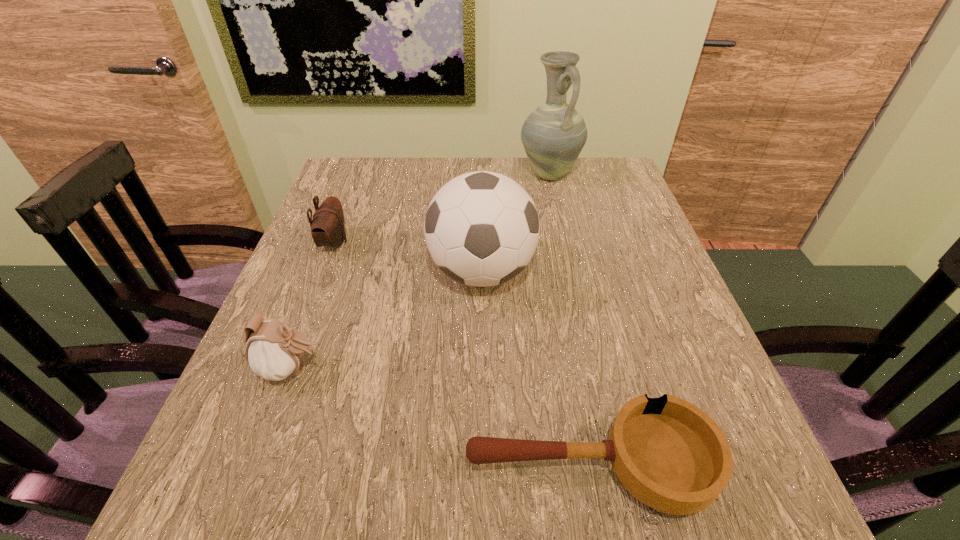
You are a GUI agent. You are given a task and a screenshot of the screen. Output one action in this format:
    pyautogui.click(x=<x>, y=<y>)
    Task: Click on the vacant area in the image that satisfies the following two spatial constraints: 1. on the front-facing side of the second nearest object; 2. with the handle on the side of the saucepan
    Image resolution: width=960 pixels, height=540 pixels.
    Given the screenshot: What is the action you would take?
    pyautogui.click(x=254, y=467)

Identify the location of free space that satisfies the following two spatial constraints: 1. on the front-facing side of the second nearest object; 2. with the handle on the side of the saucepan. (254, 467).

I want to click on free space in the image that satisfies the following two spatial constraints: 1. on the front-facing side of the fourth farthest object; 2. with the handle on the side of the shortest object, so click(x=254, y=467).

At what (x,y) coordinates should I click in order to perform the action: click on free space that satisfies the following two spatial constraints: 1. with the handle on the side of the saucepan; 2. with the flap open on the farther pouch. Please return your answer as a coordinate pair (x, y). This screenshot has width=960, height=540. Looking at the image, I should click on (548, 242).

Find the location of a particular element. The width and height of the screenshot is (960, 540). free space that satisfies the following two spatial constraints: 1. with the handle on the side of the saucepan; 2. on the front-facing side of the fourth farthest object is located at coordinates (571, 369).